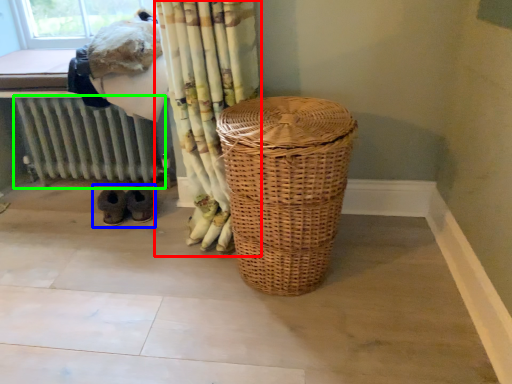
Question: Which object is positioned farthest from curtain (highlighted by a red box)? Select from footwear (highlighted by a blue box) and radiator (highlighted by a green box).

Choices:
 (A) footwear
 (B) radiator

Answer: (B)